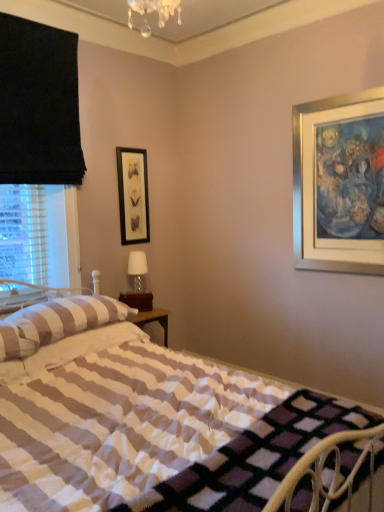
Question: Is black matte picture frame at upper center shorter than striped fabric pillow at left?

Choices:
 (A) no
 (B) yes

Answer: (A)

Question: Can you confirm if black matte picture frame at upper center is positioned to the right of striped fabric pillow at left?

Choices:
 (A) yes
 (B) no

Answer: (A)

Question: Does black matte picture frame at upper center have a larger size compared to striped fabric pillow at left?

Choices:
 (A) yes
 (B) no

Answer: (B)

Question: From a real-world perspective, does black matte picture frame at upper center sit lower than striped fabric pillow at left?

Choices:
 (A) yes
 (B) no

Answer: (B)

Question: From the image's perspective, would you say black matte picture frame at upper center is shown under striped fabric pillow at left?

Choices:
 (A) no
 (B) yes

Answer: (A)

Question: From the image's perspective, is black matte picture frame at upper center located above striped fabric pillow at left?

Choices:
 (A) no
 (B) yes

Answer: (B)

Question: Does white striped fabric bed at center have a lesser width compared to striped fabric pillow at left?

Choices:
 (A) yes
 (B) no

Answer: (B)

Question: Can you confirm if white striped fabric bed at center is taller than striped fabric pillow at left?

Choices:
 (A) yes
 (B) no

Answer: (A)

Question: Does white striped fabric bed at center have a smaller size compared to striped fabric pillow at left?

Choices:
 (A) yes
 (B) no

Answer: (B)

Question: Is white striped fabric bed at center beside striped fabric pillow at left?

Choices:
 (A) yes
 (B) no

Answer: (B)

Question: From a real-world perspective, is white striped fabric bed at center positioned under striped fabric pillow at left based on gravity?

Choices:
 (A) yes
 (B) no

Answer: (A)

Question: From a real-world perspective, is white striped fabric bed at center physically above striped fabric pillow at left?

Choices:
 (A) no
 (B) yes

Answer: (A)

Question: Can you confirm if striped fabric pillow at left is thinner than black matte picture frame at upper center?

Choices:
 (A) no
 (B) yes

Answer: (A)